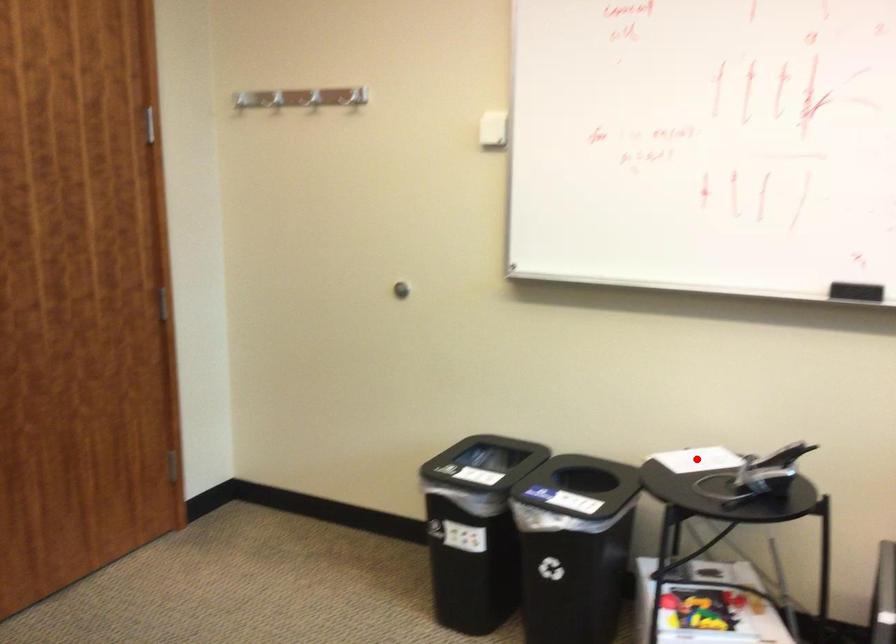
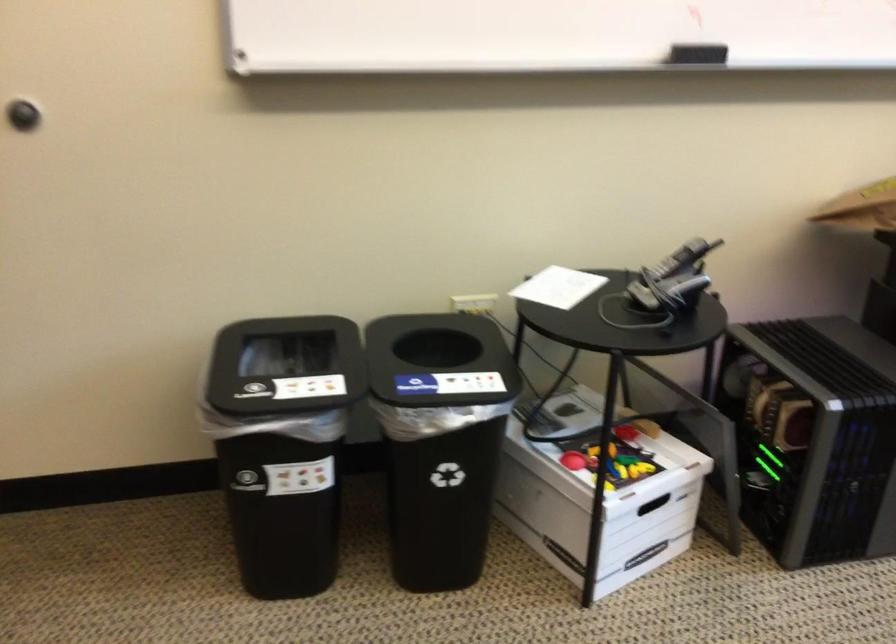
Question: A red point is marked in image1. In image2, is the corresponding 3D point closer to the camera or farther? Reply with the corresponding letter.

Choices:
 (A) The corresponding 3D point is closer.
 (B) The corresponding 3D point is farther.

Answer: (A)